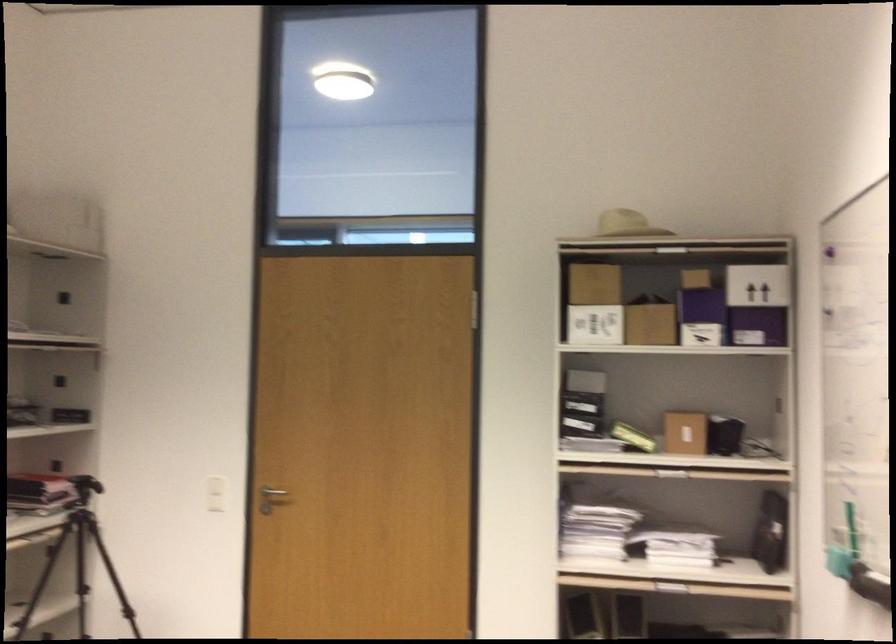
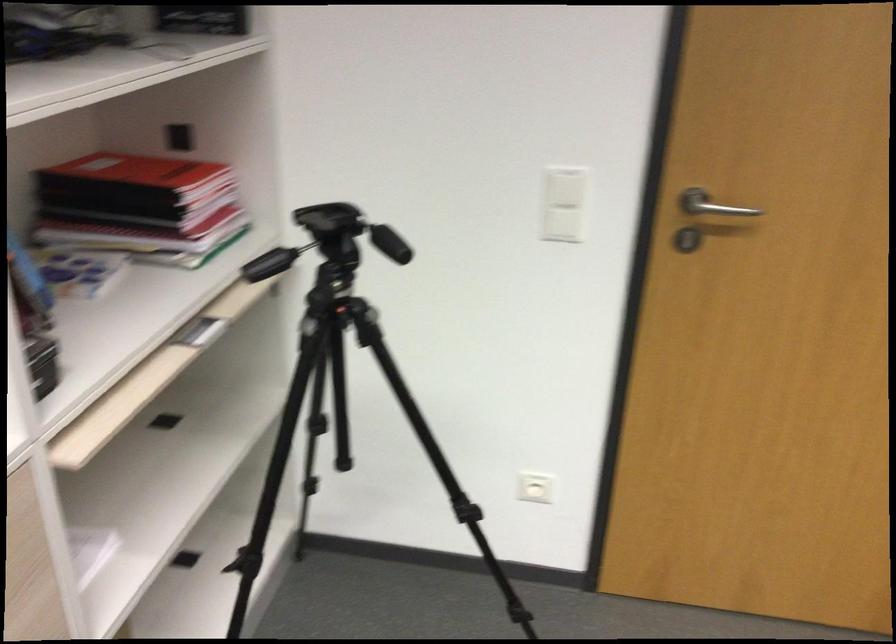
Where in the second image is the point corresponding to (221,500) from the first image?

(563, 225)